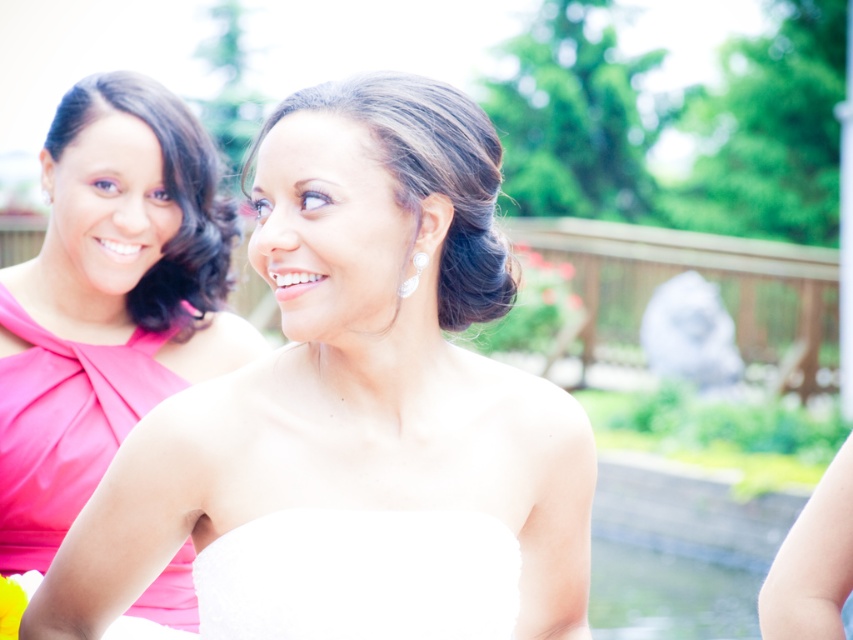
Question: Does pink satin dress at left have a smaller size compared to pearl shiny earring at upper center?

Choices:
 (A) yes
 (B) no

Answer: (B)

Question: Considering the relative positions of white satin dress at center and pink satin dress at left in the image provided, where is white satin dress at center located with respect to pink satin dress at left?

Choices:
 (A) above
 (B) below

Answer: (A)

Question: Is matte pink dress at left below pearl shiny earring at upper center?

Choices:
 (A) yes
 (B) no

Answer: (A)

Question: Which of the following is the closest to the observer?

Choices:
 (A) pink satin dress at left
 (B) pearl shiny earring at upper center

Answer: (B)

Question: Among these points, which one is nearest to the camera?

Choices:
 (A) (404, 292)
 (B) (196, 252)
 (C) (537, 436)

Answer: (A)

Question: Which point is farther from the camera taking this photo?

Choices:
 (A) (62, 436)
 (B) (387, 483)
 (C) (172, 388)
 (D) (422, 259)

Answer: (C)